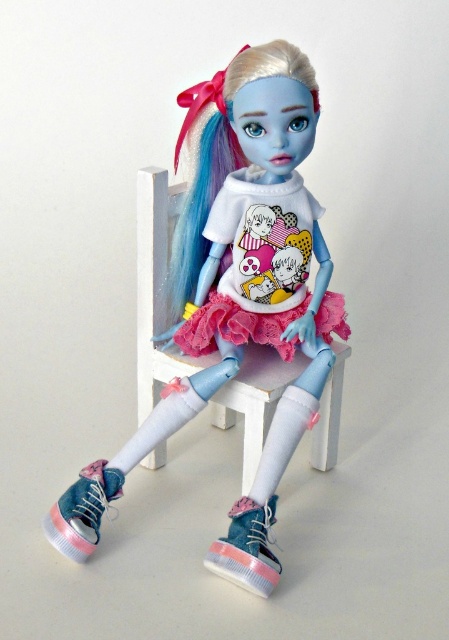
Question: Which point is farther from the camera taking this photo?

Choices:
 (A) (289, 445)
 (B) (162, 248)

Answer: (B)

Question: Does blue silky hair at center appear under pink suede sneaker at lower center?

Choices:
 (A) yes
 (B) no

Answer: (B)

Question: Where is pink lace dress at center located in relation to white plastic chair at center in the image?

Choices:
 (A) above
 (B) below

Answer: (A)

Question: Can you confirm if matte white t-shirt at center is smaller than white plastic chair at center?

Choices:
 (A) no
 (B) yes

Answer: (A)

Question: Which point is farther to the camera?

Choices:
 (A) white plastic chair at center
 (B) pink canvas sneaker at lower left
 (C) blue silky hair at center

Answer: (A)

Question: Which object appears closest to the camera in this image?

Choices:
 (A) pink canvas sneaker at lower left
 (B) matte white t-shirt at center
 (C) pink suede sneaker at lower center

Answer: (C)